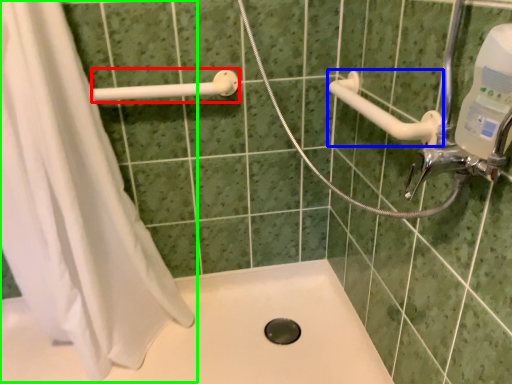
Question: Estimate the real-world distances between objects in this image. Which object is closer to shower (highlighted by a red box), shower (highlighted by a blue box) or shower curtain (highlighted by a green box)?

Choices:
 (A) shower
 (B) shower curtain

Answer: (B)